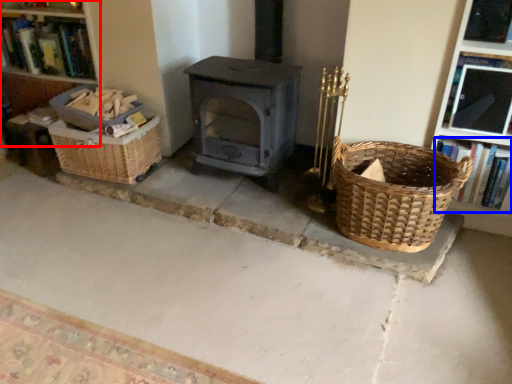
Question: Among these objects, which one is nearest to the camera, bookshelf (highlighted by a red box) or book (highlighted by a blue box)?

Choices:
 (A) bookshelf
 (B) book

Answer: (B)